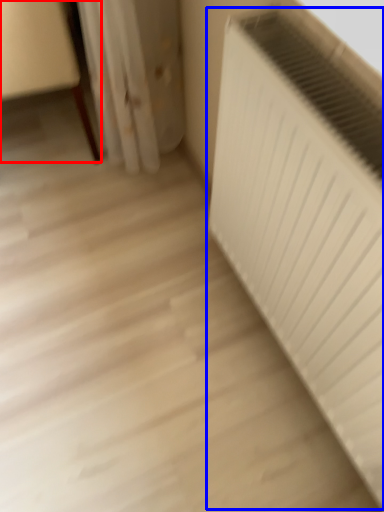
Question: Which object is closer to the camera taking this photo, furniture (highlighted by a red box) or radiator (highlighted by a blue box)?

Choices:
 (A) furniture
 (B) radiator

Answer: (B)